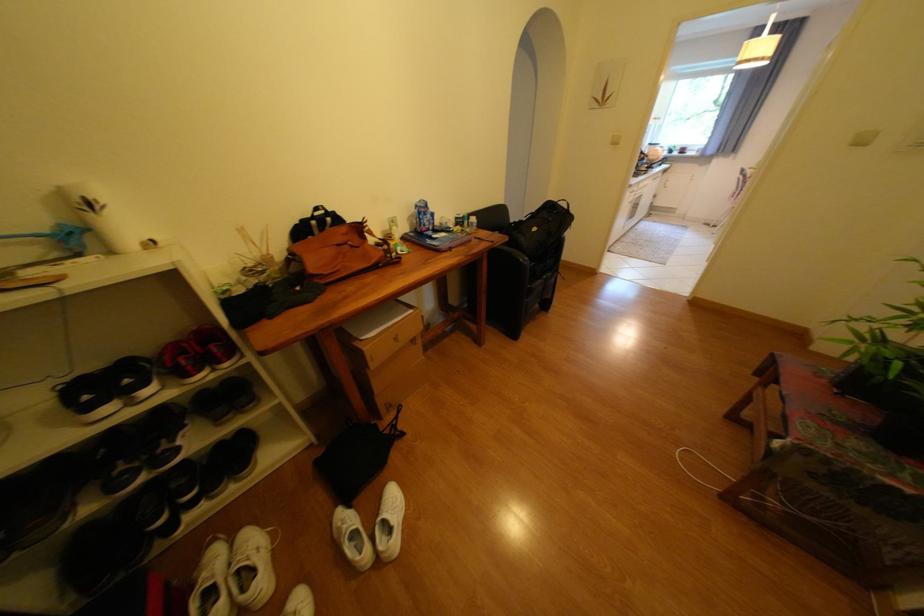
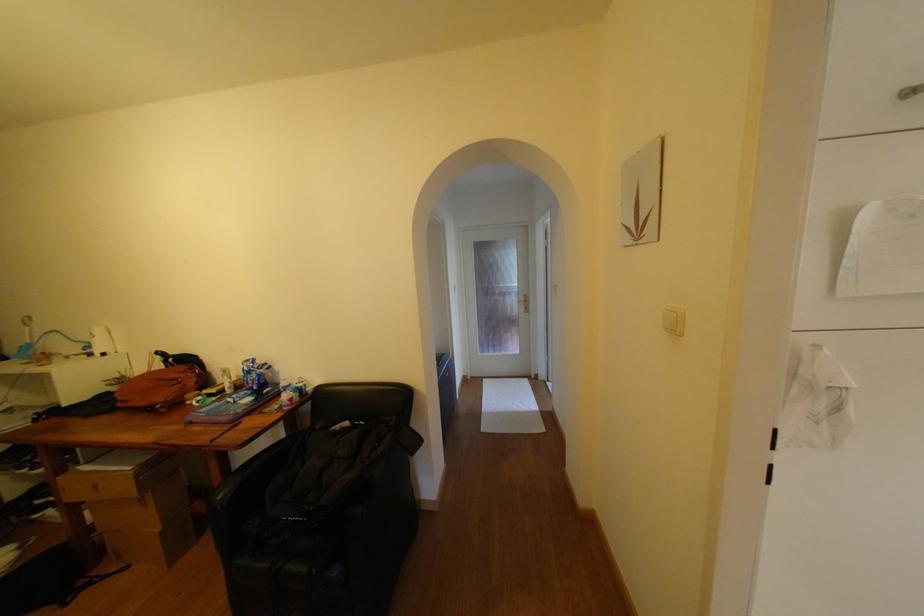
Locate, in the second image, the point that corresponds to [351,229] in the first image.

(190, 369)